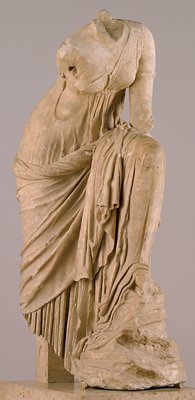
Locate an element on the screen. statue stand is located at coordinates (71, 389).